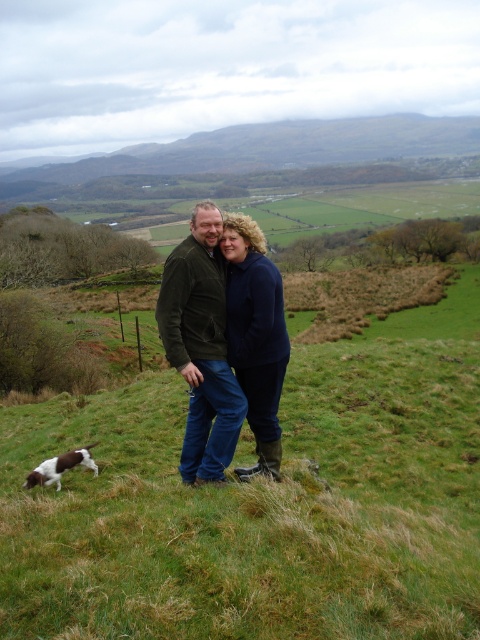
You are a hiker who wants to reach the green grassy hillside at upper center from your current position near the brown speckled fur at lower left. Considering the distance between them, can you estimate how long it would take you to walk there at a moderate pace?

The distance between the green grassy hillside at upper center and the brown speckled fur at lower left is 281.68 meters. At a moderate walking pace of approximately 5 km per hour, it would take roughly 6 minutes to cover this distance.

You are planning to set up a picnic blanket for two people. Based on the image, can the green grassy hillside at upper center accommodate the dark green corduroy jacket at center and the picnic blanket without overcrowding?

The green grassy hillside at upper center has a larger size compared to the dark green corduroy jacket at center, so there should be enough space to place both the jacket and the picnic blanket without overcrowding.

You are a photographer trying to capture the couple and their dog in the scene. You want to position yourself so that the green grassy hillside at center is visible behind the dark green corduroy jacket at center. Is this possible based on their current positions?

The green grassy hillside at center is to the right of the dark green corduroy jacket at center, so positioning yourself to the left of the jacket would allow the hillside to be visible behind it.